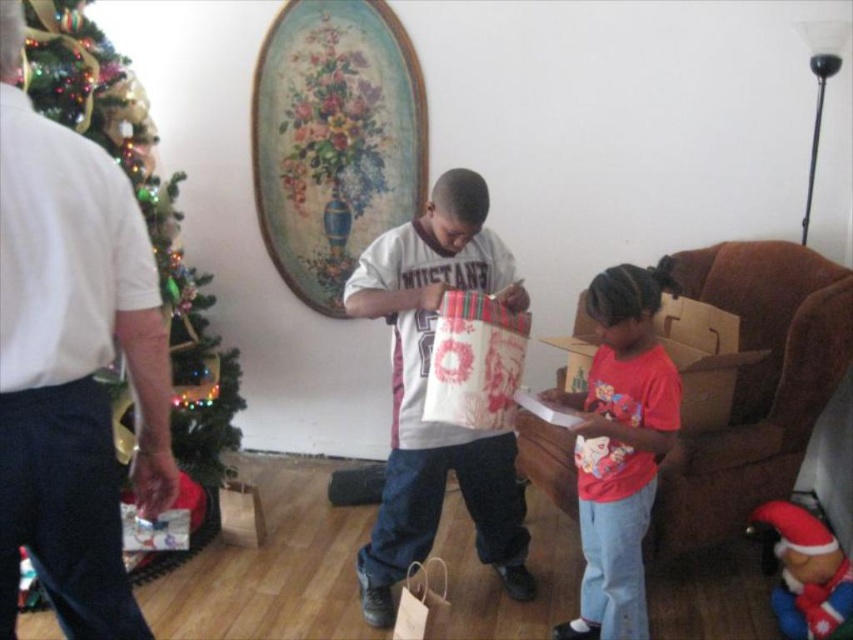
In the scene shown: Is brown fabric armchair at lower right to the left of velvety red santa at lower right from the viewer's perspective?

Indeed, brown fabric armchair at lower right is positioned on the left side of velvety red santa at lower right.

Does brown fabric armchair at lower right have a greater height compared to velvety red santa at lower right?

Indeed, brown fabric armchair at lower right has a greater height compared to velvety red santa at lower right.

Is point (740, 406) positioned after point (827, 572)?

Yes, point (740, 406) is farther from viewer.

You are a GUI agent. You are given a task and a screenshot of the screen. Output one action in this format:
    pyautogui.click(x=<x>, y=<y>)
    Task: Click on the brown fabric armchair at lower right
    
    Given the screenshot: What is the action you would take?
    pyautogui.click(x=753, y=387)

Based on the photo, between decorated green christmas tree at left and velvety red santa at lower right, which one appears on the left side from the viewer's perspective?

decorated green christmas tree at left is more to the left.

Can you confirm if decorated green christmas tree at left is bigger than velvety red santa at lower right?

Yes, decorated green christmas tree at left is bigger than velvety red santa at lower right.

The image size is (853, 640). What are the coordinates of `decorated green christmas tree at left` in the screenshot? It's located at (143, 214).

This screenshot has height=640, width=853. Identify the location of decorated green christmas tree at left. [x=143, y=214].

Is brown fabric armchair at lower right to the right of white cotton t-shirt at center from the viewer's perspective?

Indeed, brown fabric armchair at lower right is positioned on the right side of white cotton t-shirt at center.

Is brown fabric armchair at lower right closer to camera compared to white cotton t-shirt at center?

No, brown fabric armchair at lower right is behind white cotton t-shirt at center.

Is point (552, 442) closer to camera compared to point (485, 230)?

No, (552, 442) is further to viewer.

Where is `brown fabric armchair at lower right`? The image size is (853, 640). brown fabric armchair at lower right is located at coordinates (753, 387).